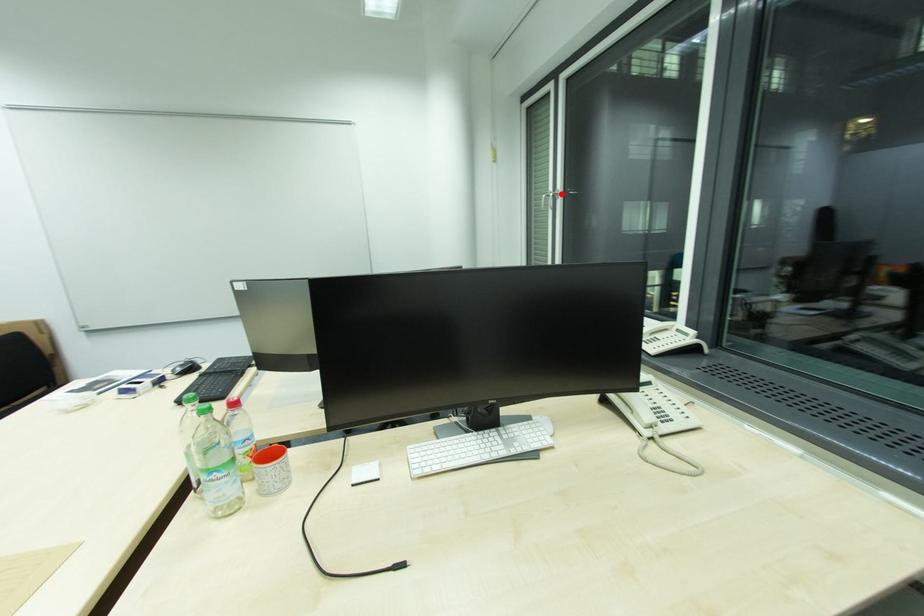
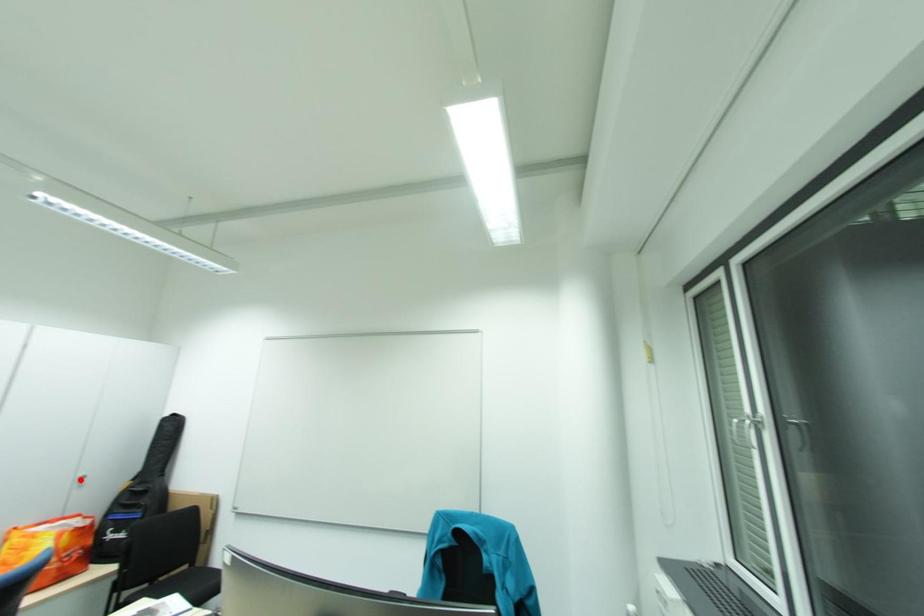
I am providing you with two images of the same scene from different viewpoints. A red point is marked on the first image and another point is marked on the second image. Do the highlighted points in image1 and image2 indicate the same real-world spot?

No